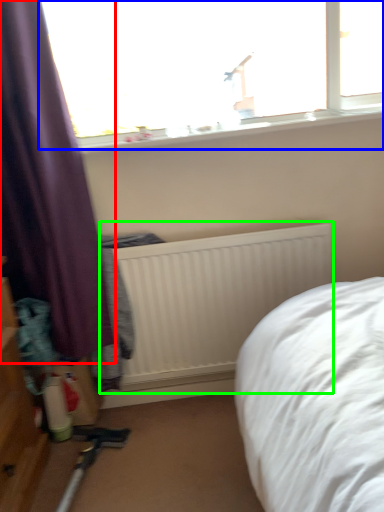
Question: Which object is positioned closest to curtain (highlighted by a red box)? Select from window (highlighted by a blue box) and radiator (highlighted by a green box).

Choices:
 (A) window
 (B) radiator

Answer: (B)